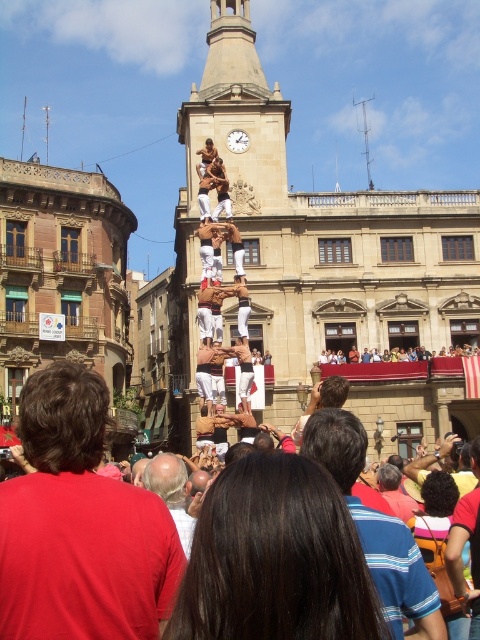
Question: Considering the relative positions of orange fabric bag at lower right and bald head at center in the image provided, where is orange fabric bag at lower right located with respect to bald head at center?

Choices:
 (A) above
 (B) below

Answer: (A)

Question: Among these objects, which one is nearest to the camera?

Choices:
 (A) red shirt at center
 (B) wooden clock at center
 (C) dark brown hair at center

Answer: (C)

Question: Does red shirt at center come in front of dark brown hair at center?

Choices:
 (A) yes
 (B) no

Answer: (B)

Question: Can you confirm if red shirt at center is smaller than orange fabric bag at lower right?

Choices:
 (A) no
 (B) yes

Answer: (A)

Question: Among these objects, which one is farthest from the camera?

Choices:
 (A) wooden clock at center
 (B) dark brown hair at center
 (C) orange fabric bag at lower right
 (D) bald head at center

Answer: (A)

Question: Which object is the closest to the bald head at center?

Choices:
 (A) wooden clock at center
 (B) red shirt at center
 (C) dark brown hair at center
 (D) blue striped shirt at center

Answer: (B)